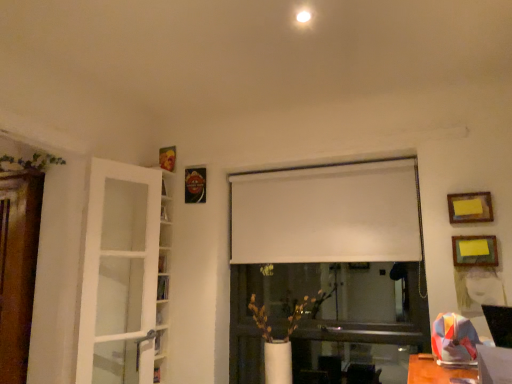
Question: Considering their positions, is white matte curtain at center located in front of or behind yellow paper at upper right, which is the 1th picture frame from bottom to top?

Choices:
 (A) behind
 (B) front

Answer: (A)

Question: From the image's perspective, relative to yellow paper at upper right, arranged as the 2th picture frame when viewed from the top, is white matte curtain at center above or below?

Choices:
 (A) above
 (B) below

Answer: (A)

Question: Which is nearer to the yellow paper at upper right, which is the 1th picture frame from bottom to top?

Choices:
 (A) green leafy plant at upper left, positioned as the second plant in right-to-left order
 (B) yellow paper at upper right, the 1th picture frame when ordered from top to bottom
 (C) white matte curtain at center
 (D) white matte vase at center, arranged as the 2th plant when viewed from the top
 (E) white glass door at left

Answer: (B)

Question: Which object is positioned closest to the white glass door at left?

Choices:
 (A) yellow paper at upper right, the 1th picture frame when ordered from top to bottom
 (B) yellow paper at upper right, arranged as the 2th picture frame when viewed from the top
 (C) green leafy plant at upper left, acting as the second plant starting from the bottom
 (D) white matte vase at center, the first plant in the bottom-to-top sequence
 (E) white matte curtain at center

Answer: (C)